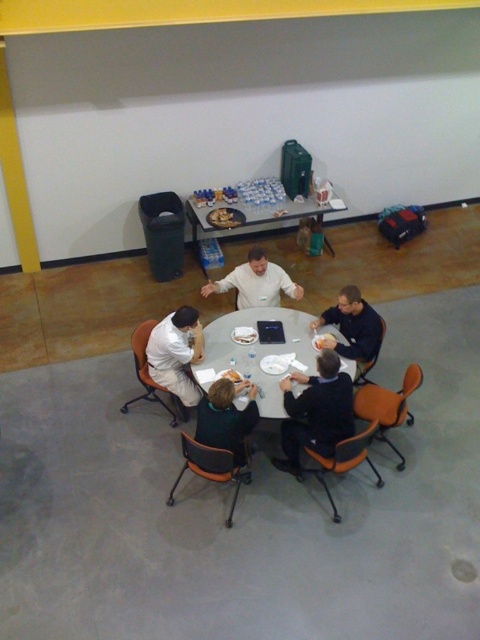
You are sitting at the back of the room and want to reach the white plastic table at center and the white matte shirt at center. Which object is closer to you?

The white plastic table at center is closer to you than the white matte shirt at center.

You are sitting at the round table and want to pass a note to the person wearing the dark blue fabric shirt at lower right. Since you are near the dark green sweater at center, will you need to pass the note across the table or can you hand it directly?

The dark green sweater at center is closer to the viewer than dark blue fabric shirt at lower right, so you are closer to the dark green sweater at center. Since the dark blue fabric shirt at lower right is further away, you will need to pass the note across the table to reach them.

Consider the image. You are organizing a small gathering and need to ensure there is enough space for everyone. Based on the image, which object, the white plastic table at center or the white matte shirt at center, would you prioritize for seating arrangements and why?

The white plastic table at center has a larger size compared to the white matte shirt at center, so you should prioritize the table for seating arrangements since it occupies more space and is essential for placing items like food and drinks.